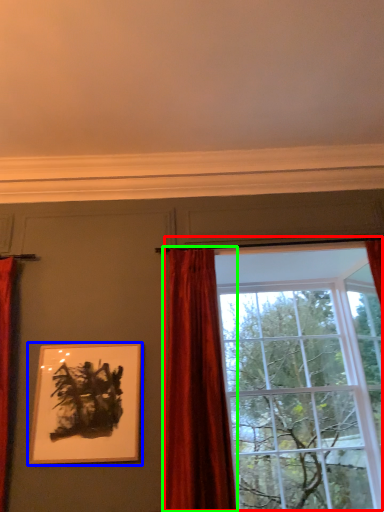
Question: Which object is positioned closest to window (highlighted by a red box)? Select from picture frame (highlighted by a blue box) and curtain (highlighted by a green box).

Choices:
 (A) picture frame
 (B) curtain

Answer: (B)